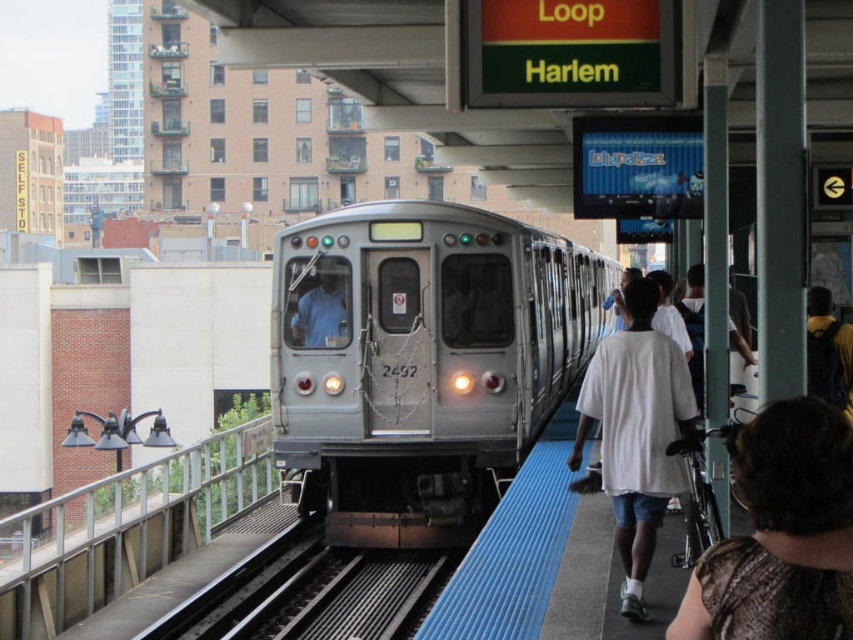
Question: Can you confirm if dark brown textured shirt at lower right is bigger than white cotton shirt at right?

Choices:
 (A) no
 (B) yes

Answer: (A)

Question: Which point is closer to the camera?

Choices:
 (A) white cotton shirt at right
 (B) dark brown textured shirt at lower right
 (C) silver metallic train at center

Answer: (B)

Question: Which of these objects is positioned farthest from the dark brown textured shirt at lower right?

Choices:
 (A) white cotton shirt at right
 (B) silver metallic train at center

Answer: (B)

Question: Can you confirm if dark brown textured shirt at lower right is bigger than white cotton shirt at right?

Choices:
 (A) no
 (B) yes

Answer: (A)

Question: Is silver metallic train at center smaller than white cotton shirt at right?

Choices:
 (A) no
 (B) yes

Answer: (A)

Question: Among these objects, which one is nearest to the camera?

Choices:
 (A) white cotton shirt at right
 (B) dark brown textured shirt at lower right

Answer: (B)